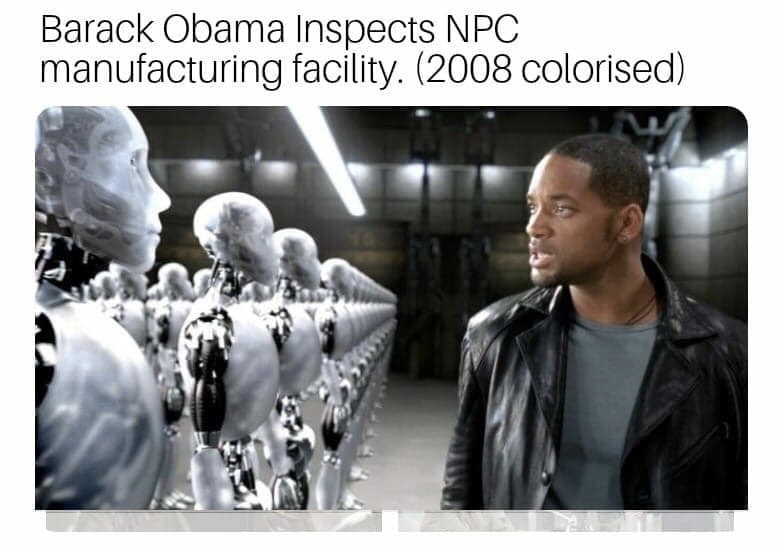
This screenshot has width=782, height=545. Find the location of `light`. light is located at coordinates (334, 183).